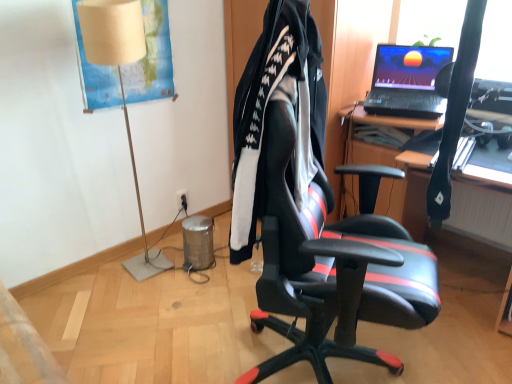
Question: Is the position of black fabric jacket at center more distant than that of beige fabric lampshade at left?

Choices:
 (A) yes
 (B) no

Answer: (B)

Question: Does black fabric jacket at center touch beige fabric lampshade at left?

Choices:
 (A) no
 (B) yes

Answer: (A)

Question: From a real-world perspective, is black fabric jacket at center on beige fabric lampshade at left?

Choices:
 (A) no
 (B) yes

Answer: (B)

Question: Is black fabric jacket at center aimed at beige fabric lampshade at left?

Choices:
 (A) yes
 (B) no

Answer: (B)

Question: Does black fabric jacket at center have a lesser width compared to beige fabric lampshade at left?

Choices:
 (A) yes
 (B) no

Answer: (A)

Question: Does black fabric jacket at center contain beige fabric lampshade at left?

Choices:
 (A) no
 (B) yes

Answer: (A)

Question: From the image's perspective, is black plastic power outlet at lower center located beneath beige fabric lampshade at left?

Choices:
 (A) no
 (B) yes

Answer: (B)

Question: Is black plastic power outlet at lower center completely or partially outside of beige fabric lampshade at left?

Choices:
 (A) yes
 (B) no

Answer: (A)

Question: Is black plastic power outlet at lower center further to the viewer compared to beige fabric lampshade at left?

Choices:
 (A) no
 (B) yes

Answer: (B)

Question: Is black plastic power outlet at lower center taller than beige fabric lampshade at left?

Choices:
 (A) yes
 (B) no

Answer: (B)

Question: Can you confirm if black plastic power outlet at lower center is bigger than beige fabric lampshade at left?

Choices:
 (A) yes
 (B) no

Answer: (B)

Question: Is black plastic power outlet at lower center thinner than beige fabric lampshade at left?

Choices:
 (A) yes
 (B) no

Answer: (A)

Question: Is black fabric jacket at center closer to camera compared to black leather chair at center?

Choices:
 (A) yes
 (B) no

Answer: (B)